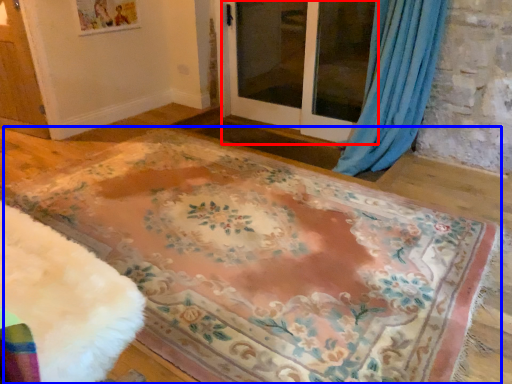
Question: Which object appears closest to the camera in this image, screen door (highlighted by a red box) or mat (highlighted by a blue box)?

Choices:
 (A) screen door
 (B) mat

Answer: (B)